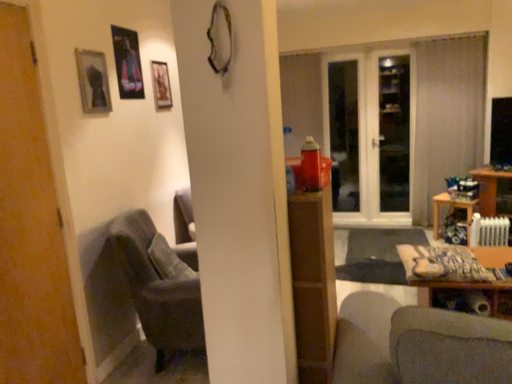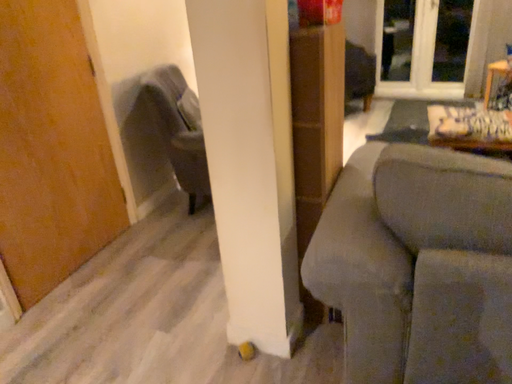
Question: Which way did the camera rotate in the video?

Choices:
 (A) rotated right
 (B) rotated left

Answer: (B)